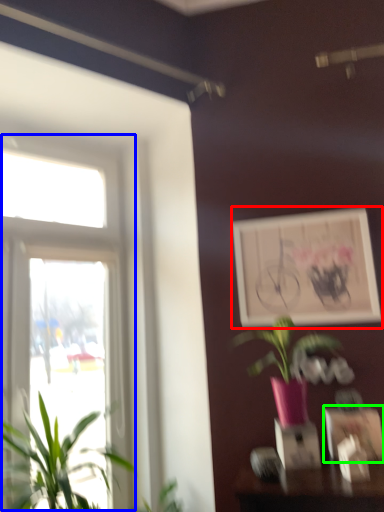
Question: Considering the real-world distances, which object is closest to picture frame (highlighted by a red box)? window (highlighted by a blue box) or picture frame (highlighted by a green box).

Choices:
 (A) window
 (B) picture frame

Answer: (B)